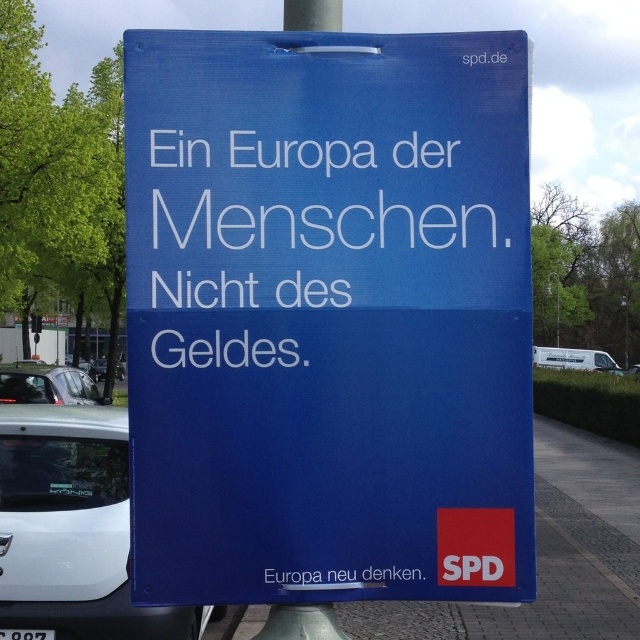
Who is positioned more to the right, blue paper sign at center or white glossy car at lower left?

blue paper sign at center

Can you confirm if blue paper sign at center is bigger than white glossy car at lower left?

Incorrect, blue paper sign at center is not larger than white glossy car at lower left.

What do you see at coordinates (328, 312) in the screenshot? I see `blue paper sign at center` at bounding box center [328, 312].

Locate an element on the screen. The width and height of the screenshot is (640, 640). blue paper sign at center is located at coordinates (328, 312).

Can you confirm if white text on blue sign at center is positioned below white paper text at center?

No.

Which is in front, point (435, 237) or point (282, 584)?

Point (282, 584) is in front.

This screenshot has height=640, width=640. I want to click on white text on blue sign at center, so click(324, 225).

Is blue paper sign at center in front of white text on blue sign at center?

Yes, it is in front of white text on blue sign at center.

Who is higher up, blue paper sign at center or white text on blue sign at center?

Positioned higher is white text on blue sign at center.

The image size is (640, 640). Find the location of `blue paper sign at center`. blue paper sign at center is located at coordinates (328, 312).